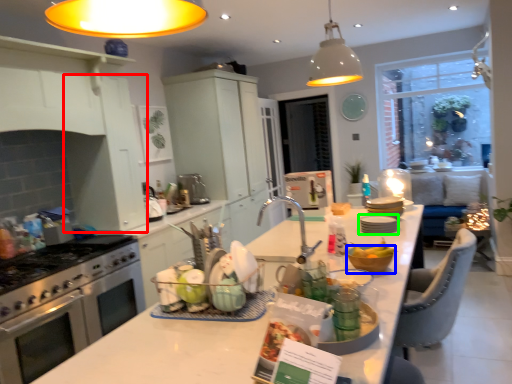
Question: Estimate the real-world distances between objects in this image. Which object is closer to cabinetry (highlighted by a red box), mixing bowl (highlighted by a blue box) or tableware (highlighted by a green box)?

Choices:
 (A) mixing bowl
 (B) tableware

Answer: (B)